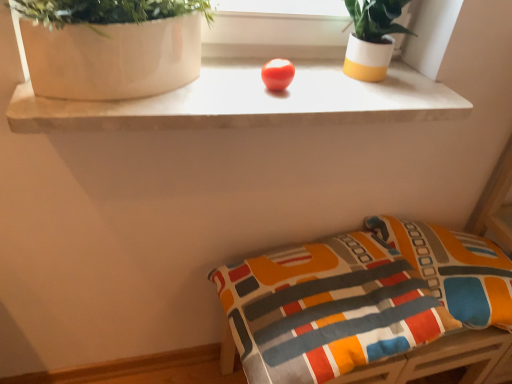
In order to click on free spot to the right of white/yellow ceramic pot at upper right in this screenshot , I will do `click(418, 84)`.